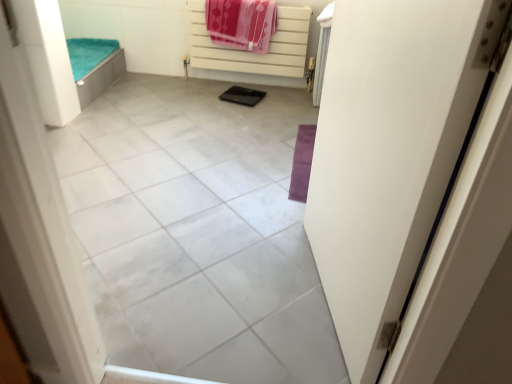
Question: Is white matte radiator at upper center bigger or smaller than gray tile at center?

Choices:
 (A) big
 (B) small

Answer: (B)

Question: Is point (193, 57) closer or farther from the camera than point (181, 112)?

Choices:
 (A) closer
 (B) farther

Answer: (B)

Question: Which is farther from the white matte radiator at upper center?

Choices:
 (A) polka dot fabric beach towel at upper center
 (B) gray tile at center
 (C) white matte door at right

Answer: (C)

Question: Considering the real-world distances, which object is closest to the gray tile at center?

Choices:
 (A) polka dot fabric beach towel at upper center
 (B) white matte radiator at upper center
 (C) white matte door at right

Answer: (C)